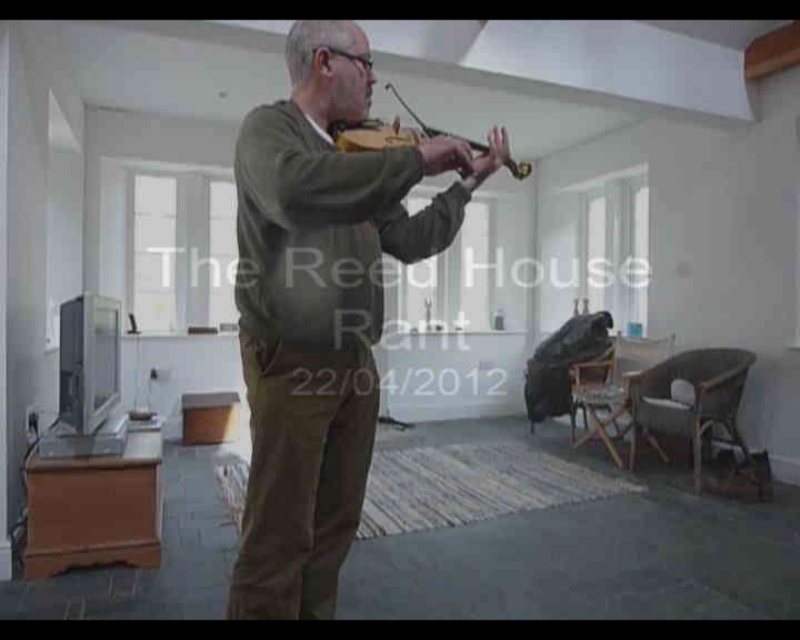
You are a photographer setting up for a portrait session in this room. You need to ensure that the matte green sweater at center and the wooden violin at center are both visible in the frame. Based on their positions, which object should you focus on first to ensure both are in focus?

The matte green sweater at center is located below the wooden violin at center. To ensure both are in focus, you should focus on the wooden violin at center first since it is higher up, allowing the sweater to fall within the depth of field.

You are a photographer setting up for a portrait. You need to ensure that the matte green sweater at center and the wooden violin at center are both visible in the frame. Based on their positions, which object should you focus on to ensure both are in focus?

The matte green sweater at center is in front of the wooden violin at center, so focusing on the sweater will ensure both are in focus as the violin is behind it.

You are a photographer positioned at the camera. You want to capture a closeup shot of the matte green sweater at center. Given that your camera can focus on objects within 3 feet, will you need to move closer or farther away to achieve this?

The distance between the matte green sweater at center and the camera is 4.33 feet. Since the camera can focus within 3 feet, you need to move closer to the matte green sweater at center to get a closeup shot.